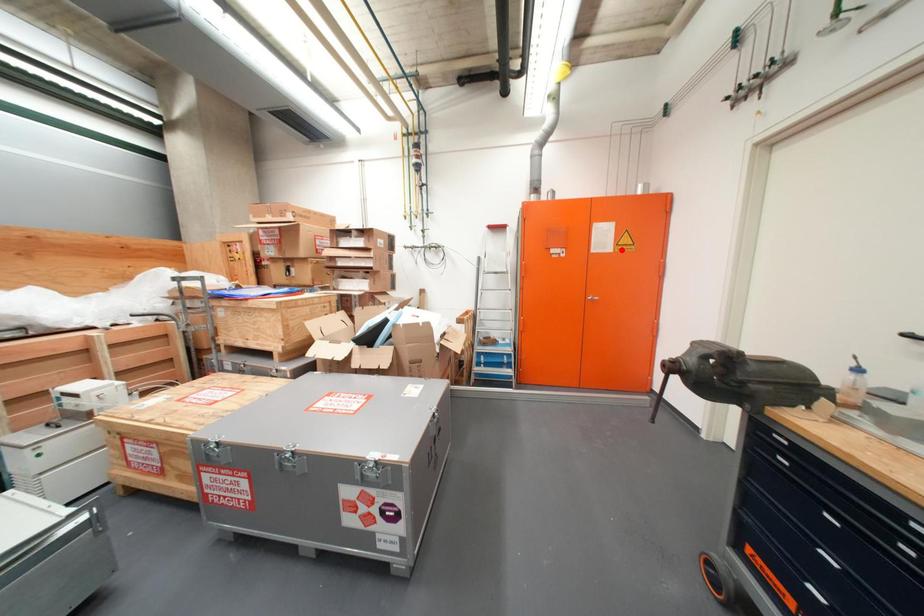
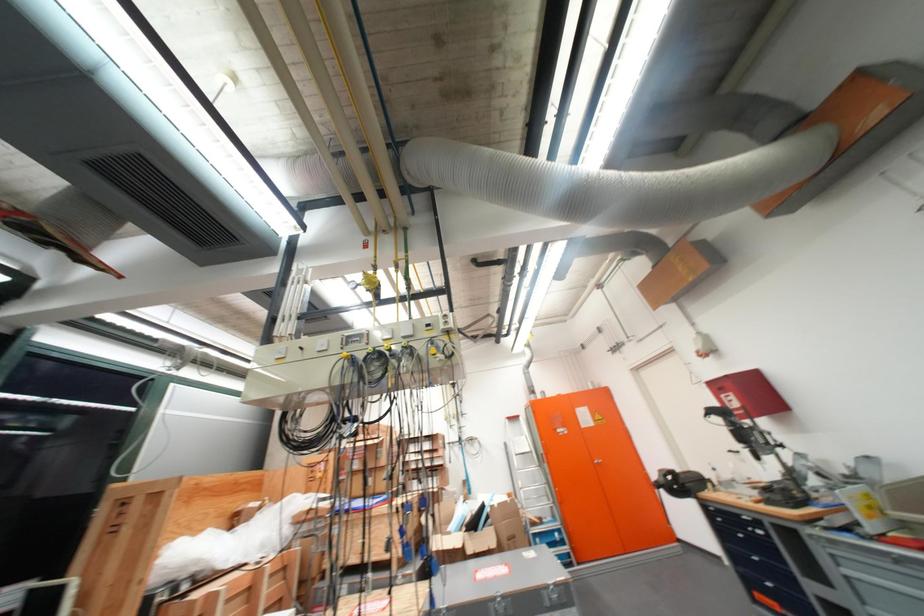
Question: I am providing you with two images of the same scene from different viewpoints. In image1, a red point is highlighted. Considering the same 3D point in image2, which of the following is correct?

Choices:
 (A) It is closer
 (B) It is farther

Answer: (B)